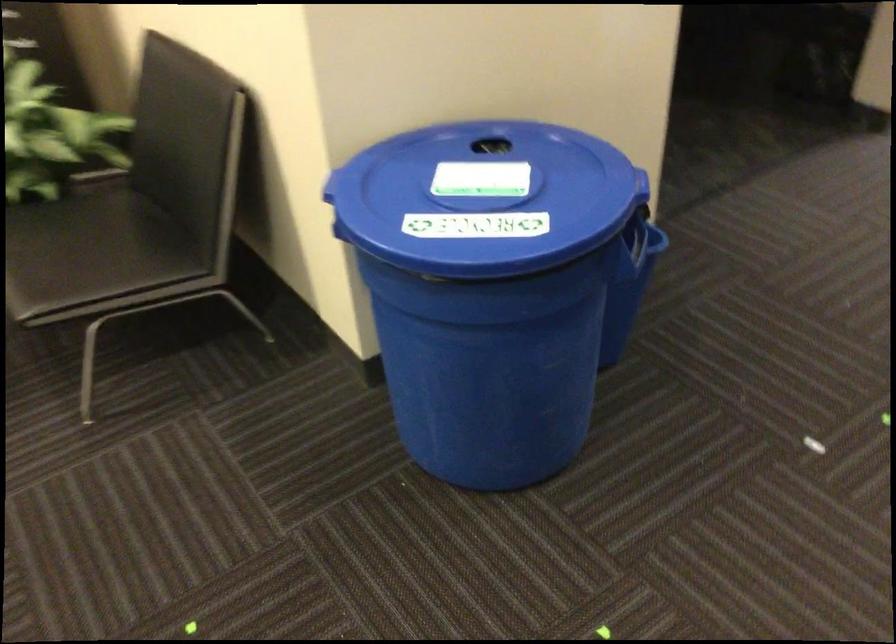
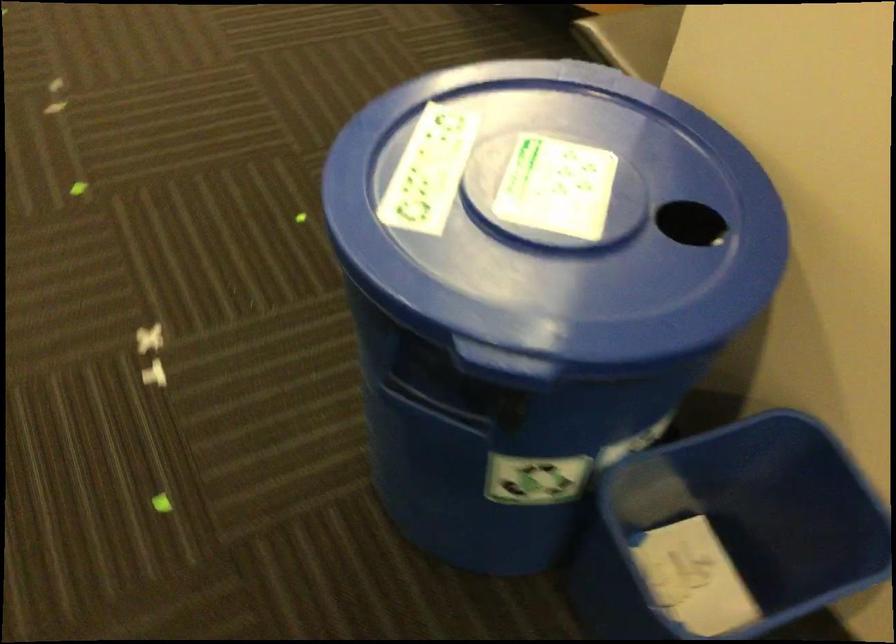
Locate, in the second image, the point that corresponds to point (478, 176) in the first image.

(556, 187)